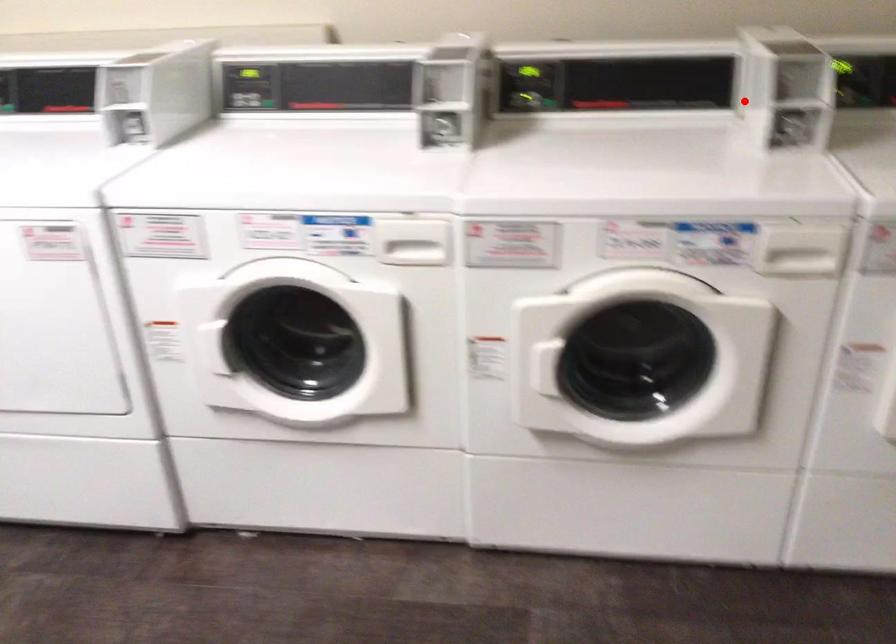
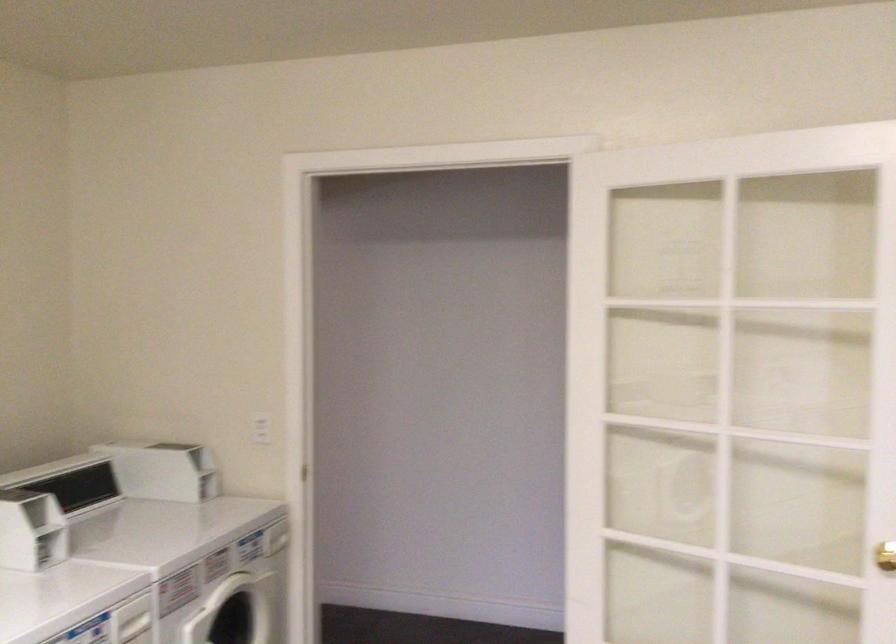
Question: I am providing you with two images of the same scene from different viewpoints. Image1 has a red point marked. In image2, the corresponding 3D location appears at what relative position? Reply with the corresponding letter.

Choices:
 (A) Closer
 (B) Farther

Answer: (B)